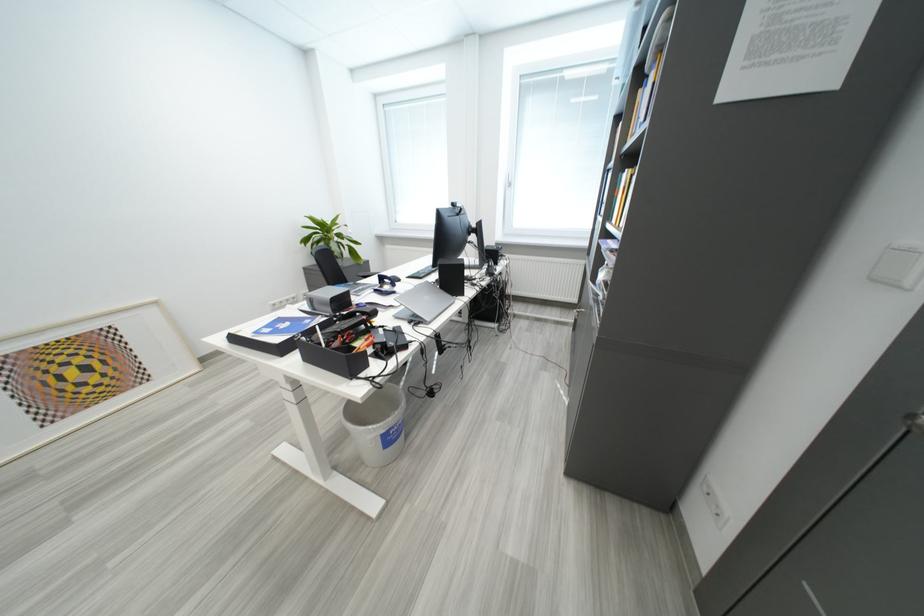
This screenshot has height=616, width=924. I want to click on white light switch, so click(x=713, y=503).